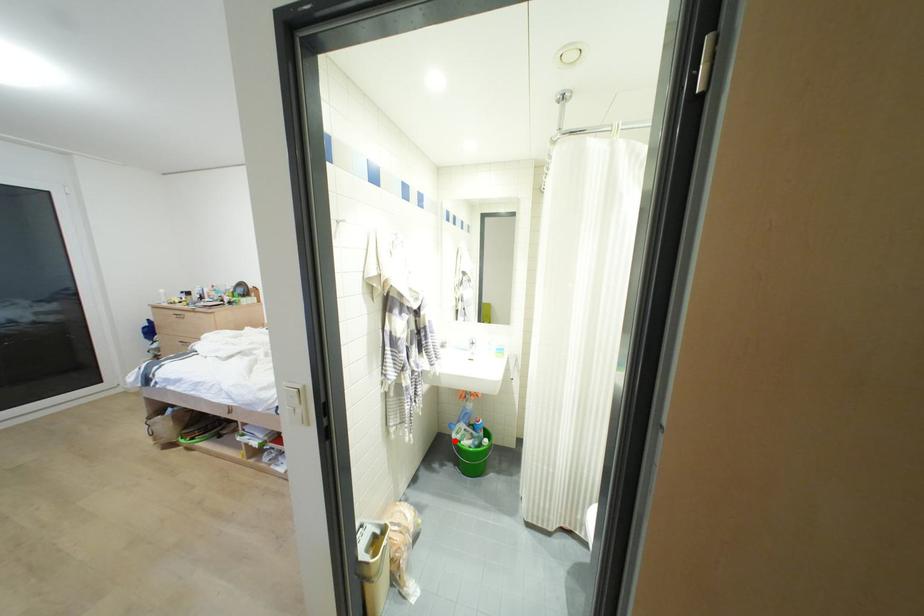
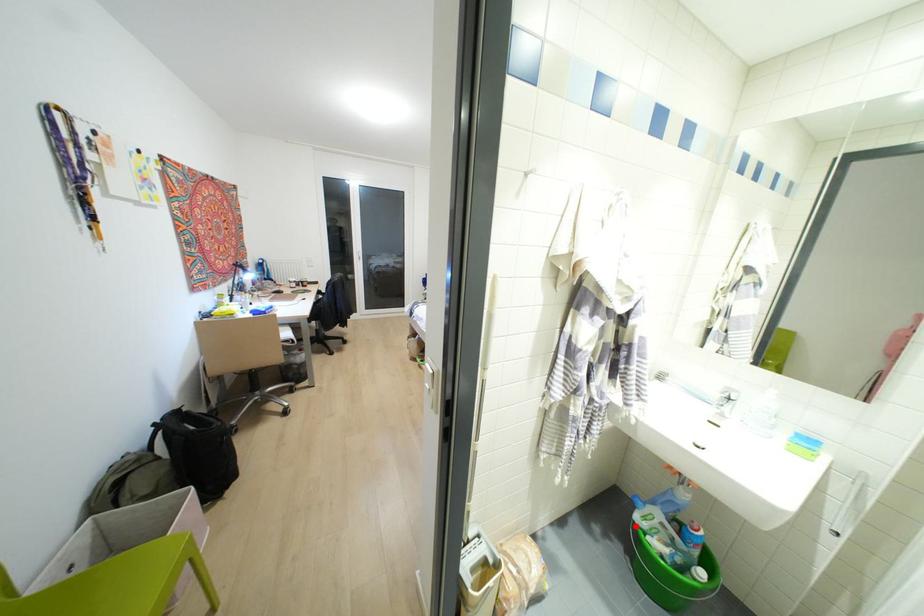
I am providing you with two images of the same scene from different viewpoints. A red point is marked on the first image and another point is marked on the second image. Are the points marked in image1 and image2 representing the same 3D position?

Yes